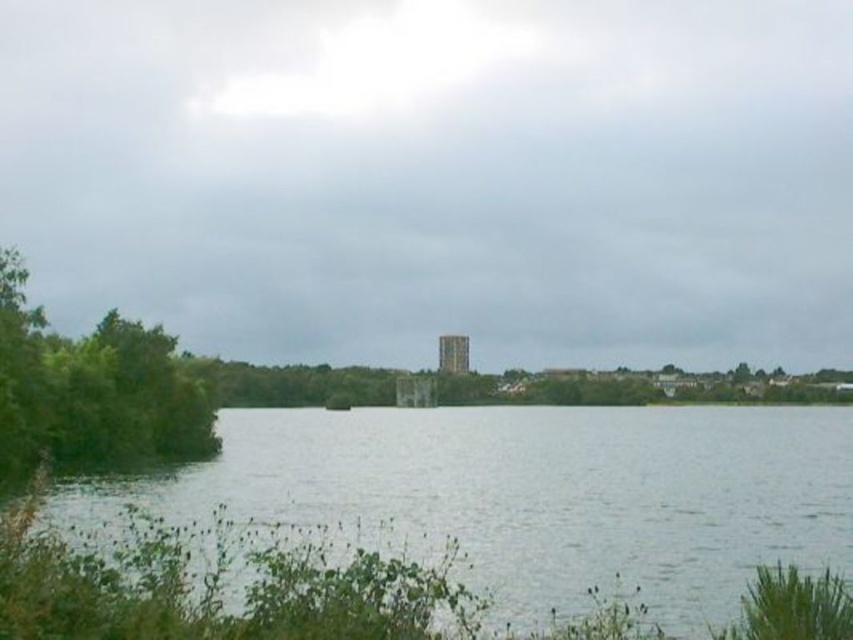
Is green water at lower center to the left of brown stone tower at center from the viewer's perspective?

In fact, green water at lower center is to the right of brown stone tower at center.

This screenshot has width=853, height=640. Describe the element at coordinates (543, 492) in the screenshot. I see `green water at lower center` at that location.

The width and height of the screenshot is (853, 640). I want to click on green water at lower center, so click(543, 492).

Can you confirm if green water at lower center is thinner than green leafy tree at left?

Incorrect, green water at lower center's width is not less than green leafy tree at left's.

Which is above, green water at lower center or green leafy tree at left?

green leafy tree at left is above.

Describe the element at coordinates (543, 492) in the screenshot. I see `green water at lower center` at that location.

Find the location of a particular element. This screenshot has height=640, width=853. green water at lower center is located at coordinates [x=543, y=492].

Between green leafy tree at left and brown stone tower at center, which one is positioned higher?

green leafy tree at left is above.

From the picture: Is green leafy tree at left above brown stone tower at center?

Yes.

Is point (16, 412) farther from viewer compared to point (442, 360)?

No, it is in front of (442, 360).

At what (x,y) coordinates should I click in order to perform the action: click on green leafy tree at left. Please return your answer as a coordinate pair (x, y). This screenshot has height=640, width=853. Looking at the image, I should click on (91, 392).